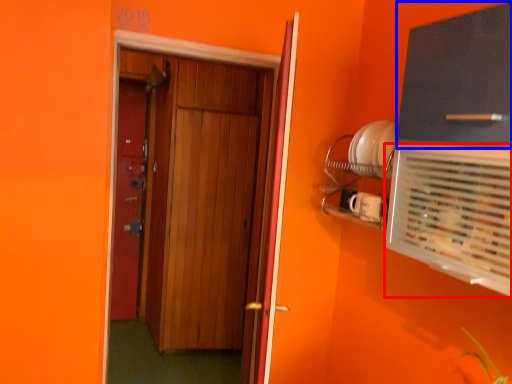
Question: Which object is further to the camera taking this photo, air conditioning (highlighted by a red box) or cabinetry (highlighted by a blue box)?

Choices:
 (A) air conditioning
 (B) cabinetry

Answer: (B)